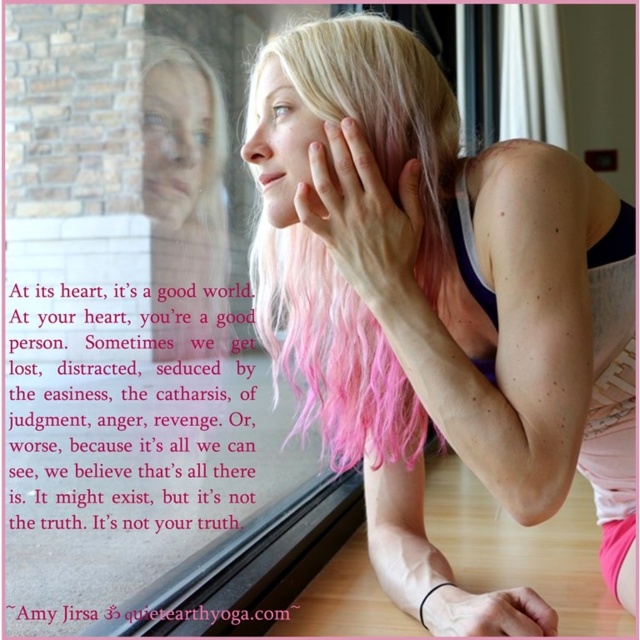
Between pink wavy hair at center and pink matte hand at center, which one is positioned higher?

Positioned higher is pink matte hand at center.

Between pink wavy hair at center and pink matte hand at center, which one appears on the left side from the viewer's perspective?

From the viewer's perspective, pink wavy hair at center appears more on the left side.

This screenshot has width=640, height=640. Describe the element at coordinates (332, 349) in the screenshot. I see `pink wavy hair at center` at that location.

The image size is (640, 640). I want to click on pink wavy hair at center, so click(332, 349).

Between point (410, 70) and point (532, 595), which one is positioned behind?

Positioned behind is point (532, 595).

Between pink hair at upper center and pink matte hair at upper center, which one appears on the right side from the viewer's perspective?

pink matte hair at upper center

Is point (381, 369) positioned before point (515, 593)?

No.

This screenshot has height=640, width=640. Identify the location of pink hair at upper center. (429, 289).

Is pink hair at upper center shorter than pink wavy hair at center?

No.

Does point (609, 515) come in front of point (412, 99)?

No, it is not.

This screenshot has height=640, width=640. Find the location of `pink hair at upper center`. pink hair at upper center is located at coordinates (429, 289).